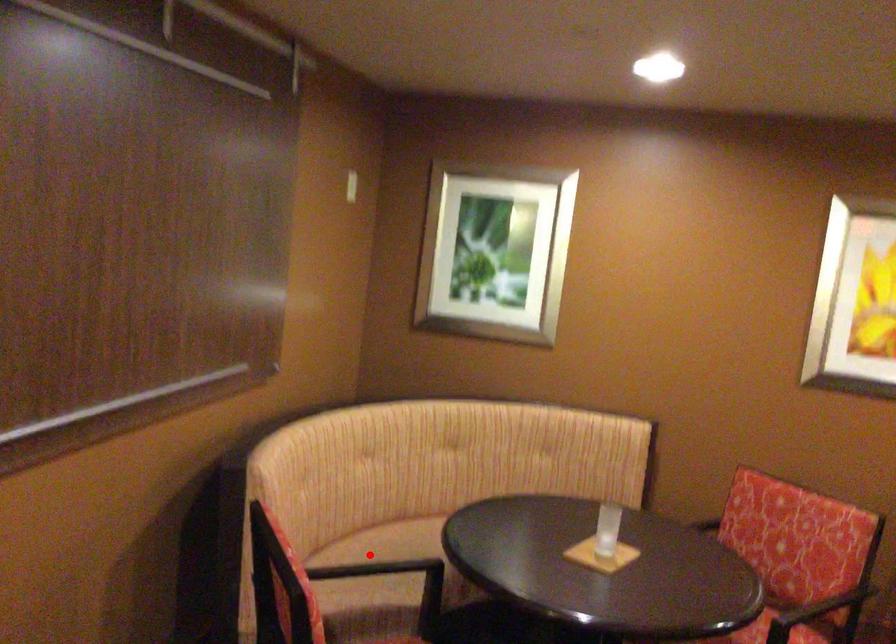
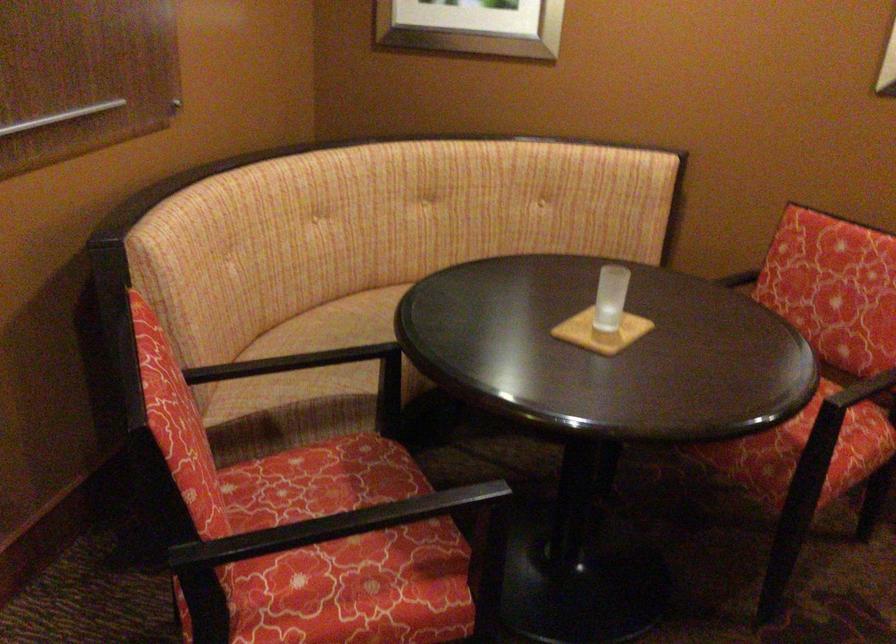
Where in the second image is the point corresponding to the highlighted location from the first image?

(332, 327)